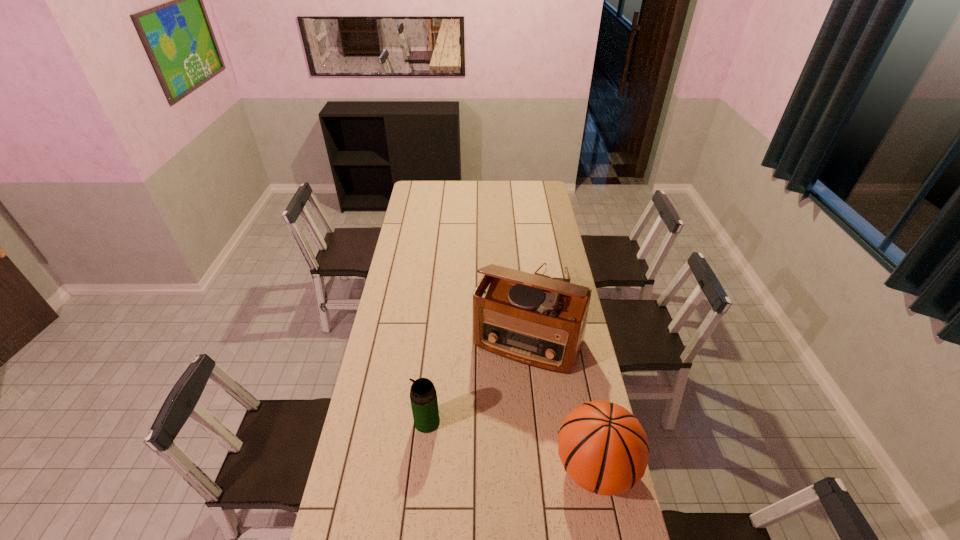
Locate an element on the screen. vacant region located 0.360m on the front panel of the third nearest object is located at coordinates (476, 453).

Locate an element on the screen. free space located 0.250m on the front panel of the third nearest object is located at coordinates coord(488,426).

Where is `vacant region located 0.150m on the front panel of the third nearest object`? vacant region located 0.150m on the front panel of the third nearest object is located at coordinates (497, 403).

Where is `vacant space located on the frames of the sunglasses`? vacant space located on the frames of the sunglasses is located at coordinates (539, 318).

The height and width of the screenshot is (540, 960). In order to click on free spot located 0.220m on the frames of the sunglasses in this screenshot , I will do `click(539, 320)`.

Where is `free space located 0.260m on the frames of the sunglasses`? free space located 0.260m on the frames of the sunglasses is located at coordinates (537, 326).

Image resolution: width=960 pixels, height=540 pixels. Identify the location of object at the near edge. (603, 448).

This screenshot has width=960, height=540. What are the coordinates of `basketball that is at the right edge` in the screenshot? It's located at (603, 448).

Locate an element on the screen. The height and width of the screenshot is (540, 960). radio receiver situated at the right edge is located at coordinates (538, 321).

I want to click on sunglasses present at the right edge, so click(x=561, y=279).